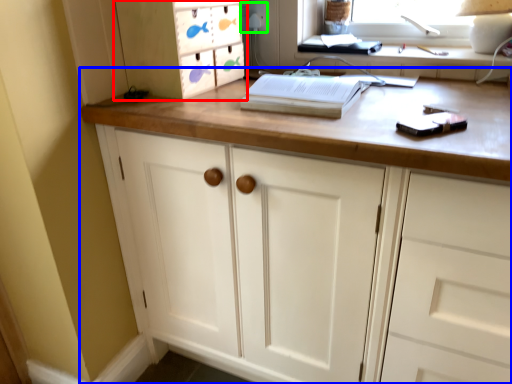
Question: Which object is the closest to the cabinetry (highlighted by a red box)? Choose among these: chest of drawers (highlighted by a blue box) or electric outlet (highlighted by a green box).

Choices:
 (A) chest of drawers
 (B) electric outlet

Answer: (A)